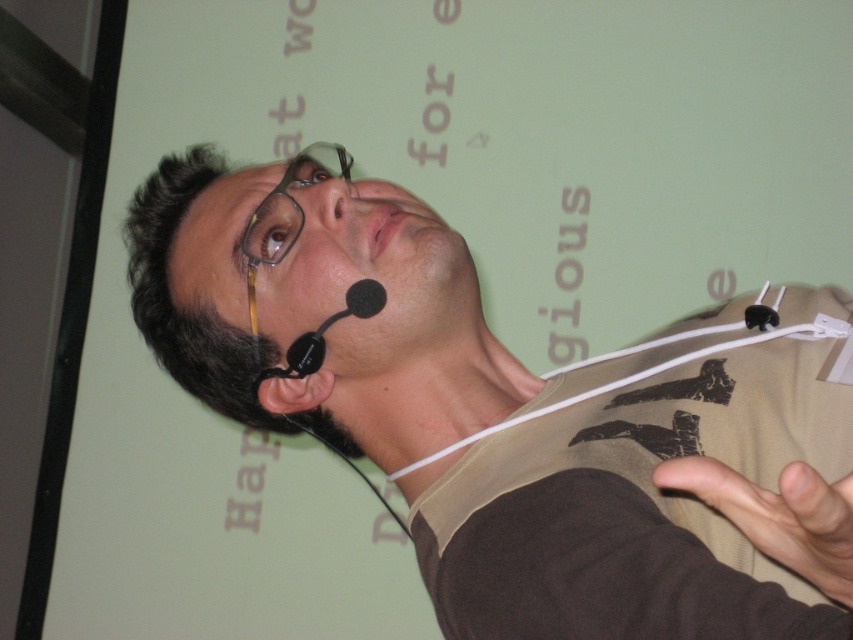
Can you confirm if matte black shirt at center is smaller than brown plastic glasses at upper center?

No, matte black shirt at center is not smaller than brown plastic glasses at upper center.

Between matte black shirt at center and brown plastic glasses at upper center, which one has less height?

brown plastic glasses at upper center

Who is more distant from viewer, (711, 442) or (283, 189)?

The point (283, 189) is behind.

Identify the location of matte black shirt at center. (508, 416).

Which is more to the left, brown fabric hand at lower right or brown plastic glasses at upper center?

From the viewer's perspective, brown plastic glasses at upper center appears more on the left side.

Who is shorter, brown fabric hand at lower right or brown plastic glasses at upper center?

Standing shorter between the two is brown fabric hand at lower right.

The width and height of the screenshot is (853, 640). What do you see at coordinates (778, 516) in the screenshot? I see `brown fabric hand at lower right` at bounding box center [778, 516].

This screenshot has width=853, height=640. In order to click on brown fabric hand at lower right in this screenshot , I will do `click(778, 516)`.

Is matte black shirt at center taller than brown fabric hand at lower right?

Correct, matte black shirt at center is much taller as brown fabric hand at lower right.

Does point (786, 364) lie in front of point (845, 582)?

No, it is not.

Which is in front, point (447, 225) or point (796, 486)?

Point (796, 486) is in front.

The height and width of the screenshot is (640, 853). Identify the location of matte black shirt at center. (508, 416).